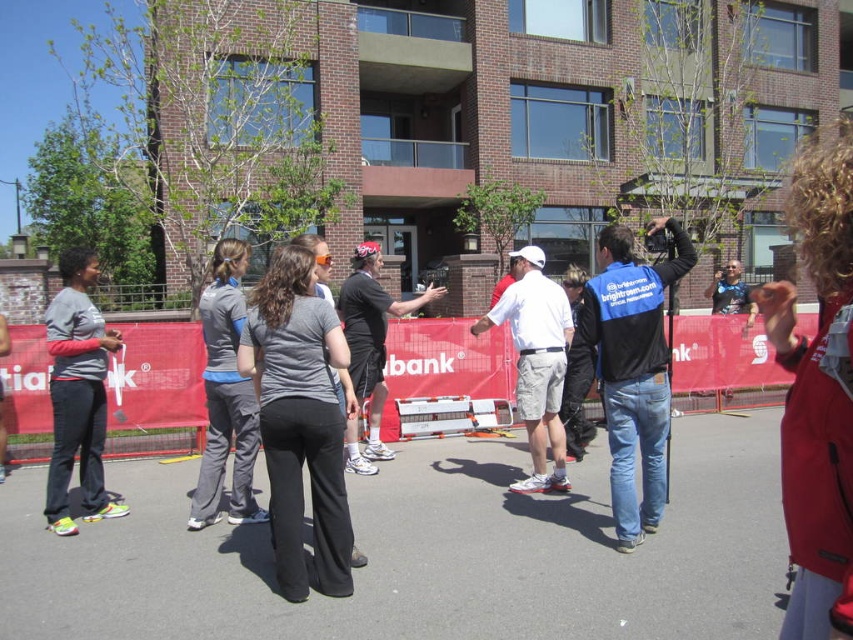
You are a photographer at the event and need to capture a clear shot of both the gray matte pants at center and the gray fabric pants at center. Since the scene is crowded, you have to decide whether to focus on the lower or upper part of the frame. Based on their positions, which part should you focus on to include both?

You should focus on the lower part of the frame because the gray matte pants at center is below the gray fabric pants at center, so capturing the lower area will ensure both are included.

You are organizing a clothing donation drive and need to categorize the gray matte pants at center and gray fabric pants at center based on their size. Which pair is bigger?

The gray matte pants at center has a larger size compared to gray fabric pants at center, so the gray matte pants at center is bigger.